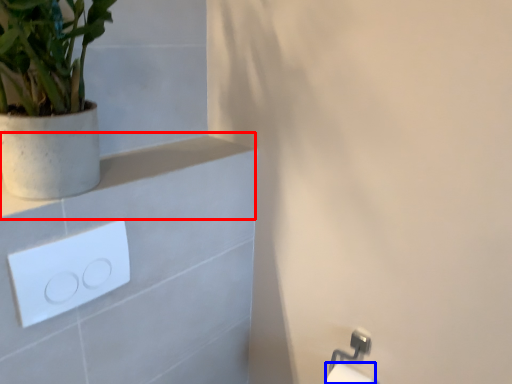
Question: Which point is further to the camera, balustrade (highlighted by a red box) or toilet paper (highlighted by a blue box)?

Choices:
 (A) balustrade
 (B) toilet paper

Answer: (B)